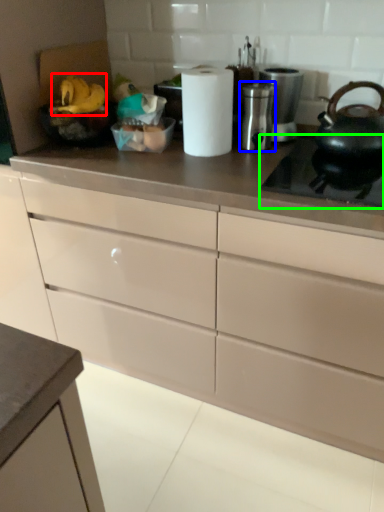
Question: Estimate the real-world distances between objects in this image. Which object is farther from food (highlighted by a red box), appliance (highlighted by a blue box) or gas stove (highlighted by a green box)?

Choices:
 (A) appliance
 (B) gas stove

Answer: (B)